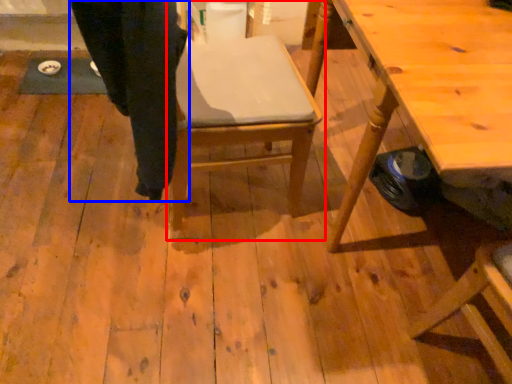
Question: Which of the following is the closest to the observer, chair (highlighted by a red box) or trousers (highlighted by a blue box)?

Choices:
 (A) chair
 (B) trousers

Answer: (B)